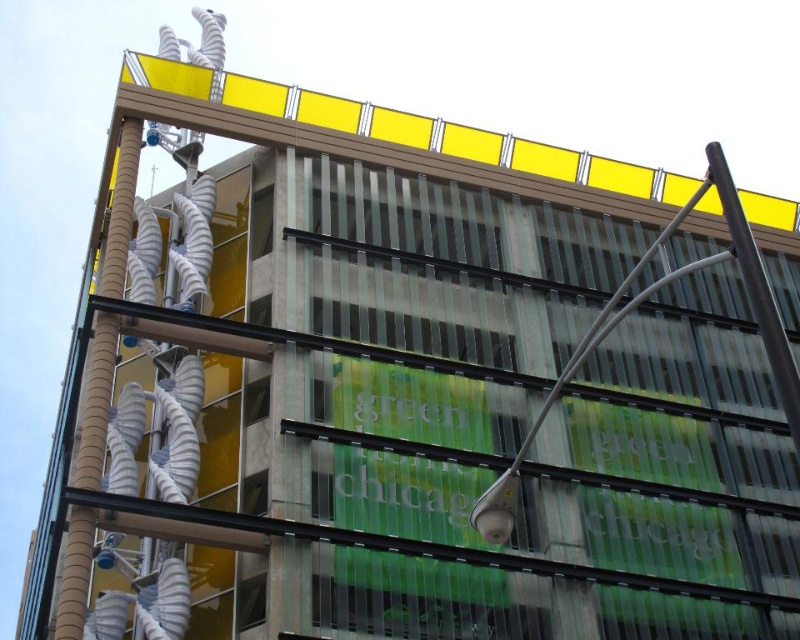
Does brown corrugated pipe at left come in front of black metal pole at upper right?

That is False.

What do you see at coordinates (96, 403) in the screenshot?
I see `brown corrugated pipe at left` at bounding box center [96, 403].

Is point (124, 269) closer to viewer compared to point (792, 392)?

That is False.

The height and width of the screenshot is (640, 800). Identify the location of brown corrugated pipe at left. (96, 403).